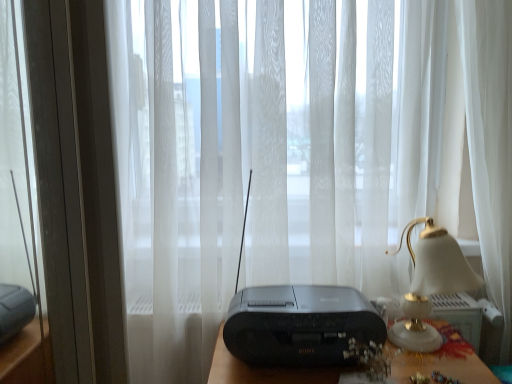
Question: From a real-world perspective, does black plastic radio at center sit lower than black plastic radio at center?

Choices:
 (A) yes
 (B) no

Answer: (B)

Question: From a real-world perspective, is black plastic radio at center over black plastic radio at center?

Choices:
 (A) no
 (B) yes

Answer: (B)

Question: Is black plastic radio at center behind black plastic radio at center?

Choices:
 (A) no
 (B) yes

Answer: (A)

Question: Would you say black plastic radio at center is outside black plastic radio at center?

Choices:
 (A) yes
 (B) no

Answer: (A)

Question: Does black plastic radio at center have a lesser width compared to black plastic radio at center?

Choices:
 (A) no
 (B) yes

Answer: (A)

Question: Based on their positions, is black plastic radio at center located to the left or right of black plastic radio at center?

Choices:
 (A) right
 (B) left

Answer: (A)

Question: Do you think black plastic radio at center is within black plastic radio at center, or outside of it?

Choices:
 (A) inside
 (B) outside

Answer: (B)

Question: Considering the positions of black plastic radio at center and black plastic radio at center in the image, is black plastic radio at center bigger or smaller than black plastic radio at center?

Choices:
 (A) small
 (B) big

Answer: (B)

Question: In the image, is black plastic radio at center positioned in front of or behind black plastic radio at center?

Choices:
 (A) front
 (B) behind

Answer: (A)

Question: Considering the positions of transparent glass door at left and matte gold lampshade at right in the image, is transparent glass door at left wider or thinner than matte gold lampshade at right?

Choices:
 (A) thin
 (B) wide

Answer: (A)

Question: From a real-world perspective, is transparent glass door at left physically located above or below matte gold lampshade at right?

Choices:
 (A) below
 (B) above

Answer: (B)

Question: Is point (4, 107) closer or farther from the camera than point (424, 304)?

Choices:
 (A) farther
 (B) closer

Answer: (B)

Question: Is transparent glass door at left taller or shorter than matte gold lampshade at right?

Choices:
 (A) tall
 (B) short

Answer: (A)

Question: Does point (293, 345) appear closer or farther from the camera than point (456, 278)?

Choices:
 (A) farther
 (B) closer

Answer: (B)

Question: Considering their positions, is black plastic radio at center located in front of or behind matte gold lampshade at right?

Choices:
 (A) front
 (B) behind

Answer: (B)